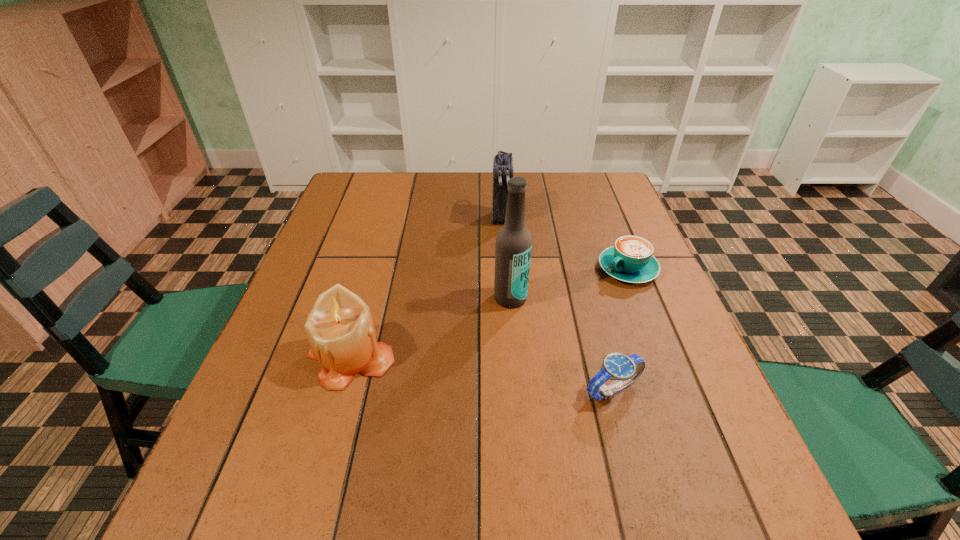
Locate an element on the screen. The image size is (960, 540). vacant space that satisfies the following two spatial constraints: 1. on the back side of the farthest object; 2. on the left side of the leftmost object is located at coordinates (390, 217).

You are a GUI agent. You are given a task and a screenshot of the screen. Output one action in this format:
    pyautogui.click(x=<x>, y=<y>)
    Task: Click on the free space that satisfies the following two spatial constraints: 1. on the back side of the beer bottle; 2. on the right side of the candle
    The width and height of the screenshot is (960, 540).
    Given the screenshot: What is the action you would take?
    pyautogui.click(x=368, y=298)